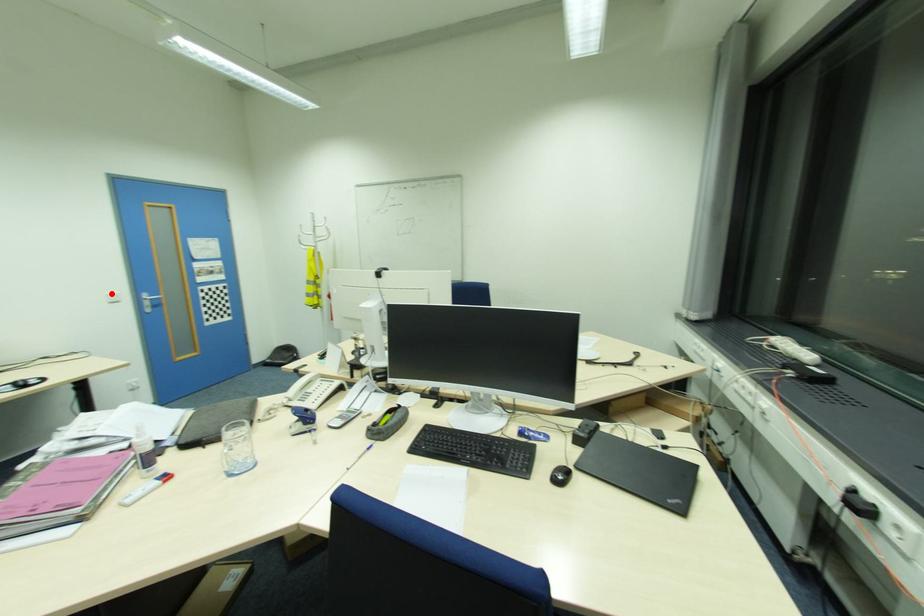
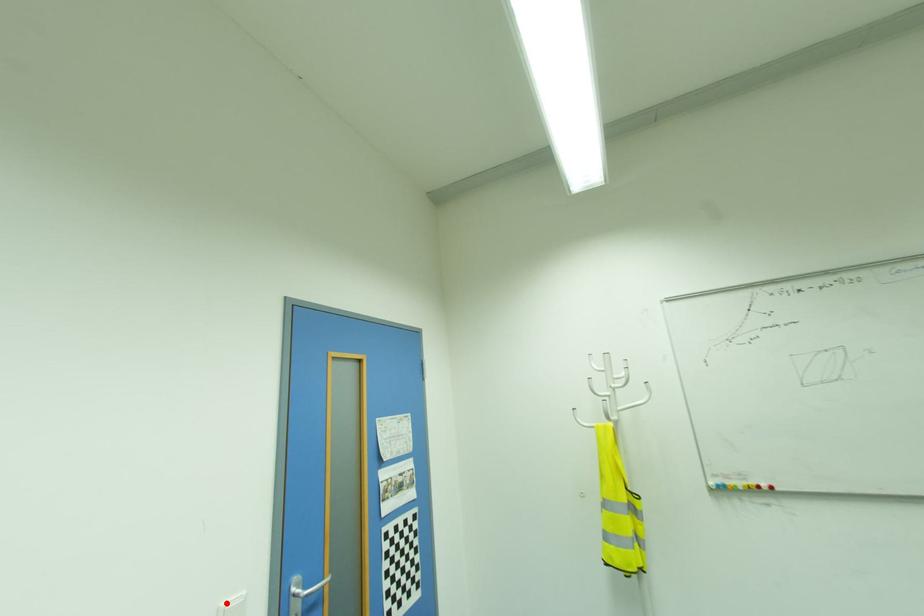
I am providing you with two images of the same scene from different viewpoints. A red point is marked on the first image and another point is marked on the second image. Is the red point in image1 aligned with the point shown in image2?

Yes